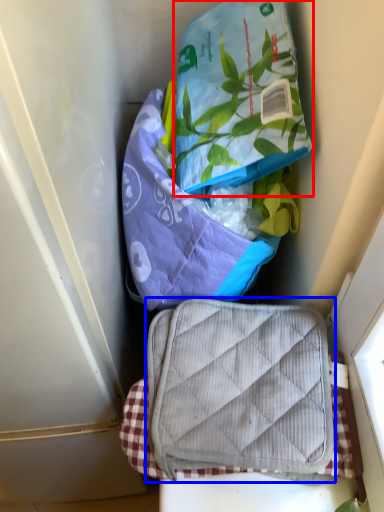
Question: Which of the following is the closest to the observer, pouch (highlighted by a red box) or luggage and bags (highlighted by a blue box)?

Choices:
 (A) pouch
 (B) luggage and bags

Answer: (A)